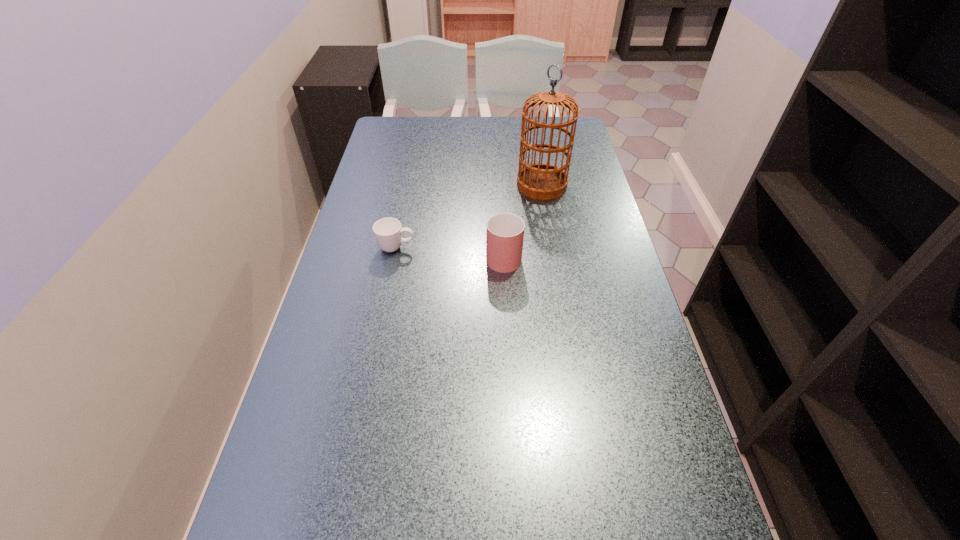
Identify the location of vacant space located 0.170m with the handle on the side of the shorter cup. [477, 248].

I want to click on object located at the left edge, so click(x=388, y=232).

This screenshot has height=540, width=960. What are the coordinates of `object at the right edge` in the screenshot? It's located at pyautogui.click(x=541, y=181).

You are a GUI agent. You are given a task and a screenshot of the screen. Output one action in this format:
    pyautogui.click(x=<x>, y=<y>)
    Task: Click on the vacant space at the far edge of the desktop
    This screenshot has width=960, height=540.
    Given the screenshot: What is the action you would take?
    (455, 143)

The width and height of the screenshot is (960, 540). In order to click on vacant region at the left edge in this screenshot , I will do `click(357, 347)`.

In the image, there is a desktop. At what (x,y) coordinates should I click in order to perform the action: click on blank space at the right edge. Please return your answer as a coordinate pair (x, y). This screenshot has width=960, height=540. Looking at the image, I should click on (585, 172).

This screenshot has height=540, width=960. Identify the location of vacant region at the far left corner of the desktop. (408, 148).

Locate an element on the screen. The height and width of the screenshot is (540, 960). vacant region between the birdcage and the leftmost object is located at coordinates (469, 217).

The height and width of the screenshot is (540, 960). In order to click on free space that is in between the tallest object and the shortest object in this screenshot , I will do (469, 217).

You are a GUI agent. You are given a task and a screenshot of the screen. Output one action in this format:
    pyautogui.click(x=<x>, y=<y>)
    Task: Click on the vacant area between the shorter cup and the second object from left to right
    
    Given the screenshot: What is the action you would take?
    pyautogui.click(x=450, y=251)